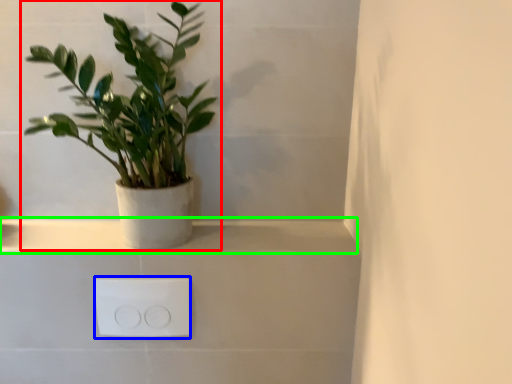
Question: Which object is the closest to the houseplant (highlighted by a red box)? Choose among these: electric outlet (highlighted by a blue box) or window sill (highlighted by a green box).

Choices:
 (A) electric outlet
 (B) window sill

Answer: (B)